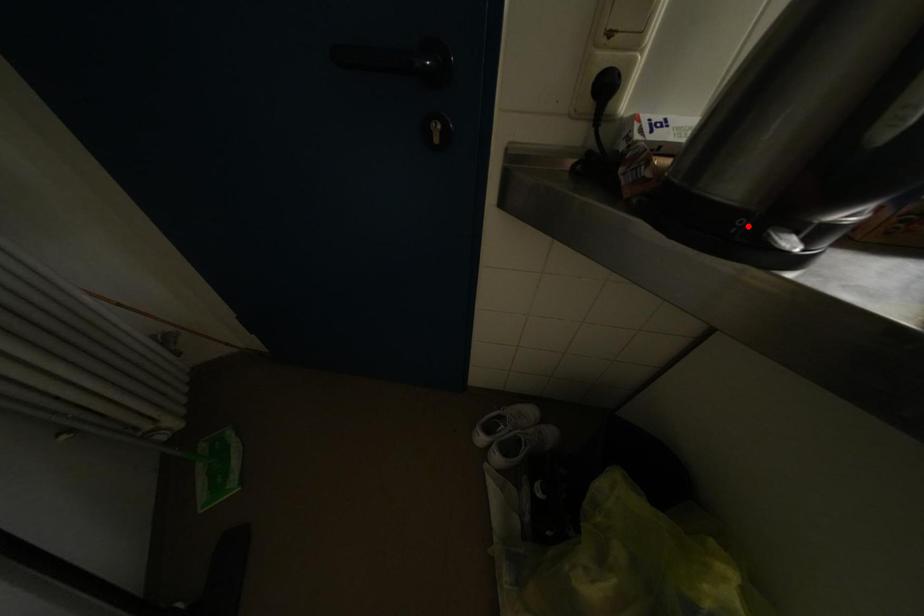
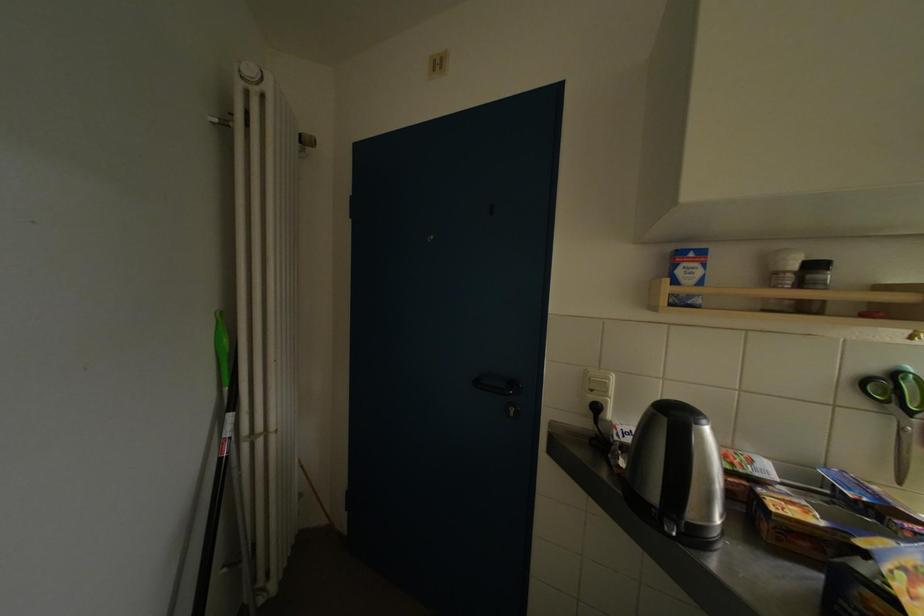
Find the pixel in the second image that matches the highlighted location in the first image.

(661, 514)